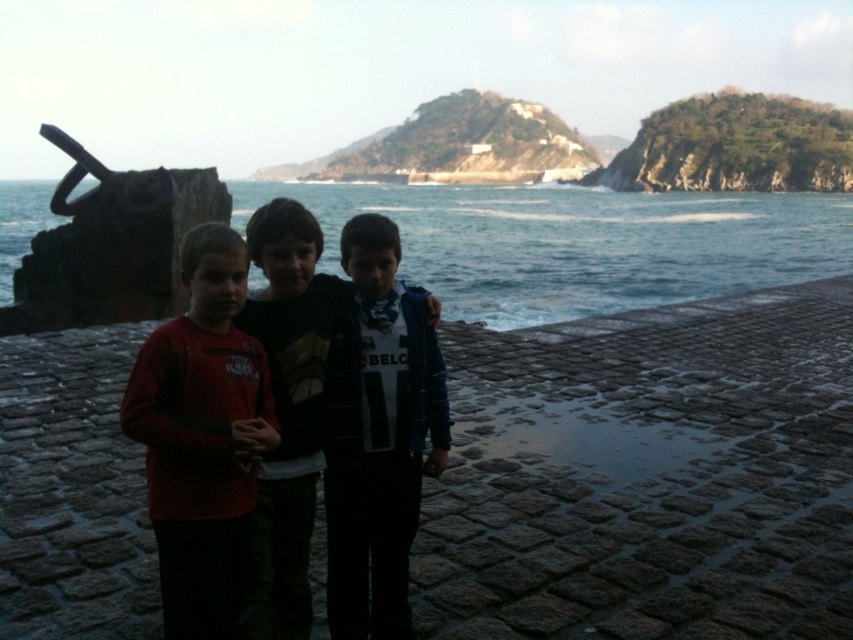
Can you confirm if blue water at center is positioned above dark blue jersey at center?

Indeed, blue water at center is positioned over dark blue jersey at center.

Who is more forward, (793, 268) or (308, 620)?

Positioned in front is point (308, 620).

The height and width of the screenshot is (640, 853). Identify the location of blue water at center. (579, 243).

Does blue water at center appear on the right side of red long-sleeve shirt at center?

Incorrect, blue water at center is not on the right side of red long-sleeve shirt at center.

Is blue water at center wider than red long-sleeve shirt at center?

Indeed, blue water at center has a greater width compared to red long-sleeve shirt at center.

Is point (573, 312) more distant than point (190, 369)?

Yes, point (573, 312) is farther from viewer.

Where is `blue water at center`? The image size is (853, 640). blue water at center is located at coordinates (579, 243).

Is the position of smooth stone pavement at center more distant than that of rusty metal anchor at left?

No, it is in front of rusty metal anchor at left.

Which is in front, point (751, 582) or point (170, 195)?

Positioned in front is point (751, 582).

The width and height of the screenshot is (853, 640). I want to click on smooth stone pavement at center, so click(647, 476).